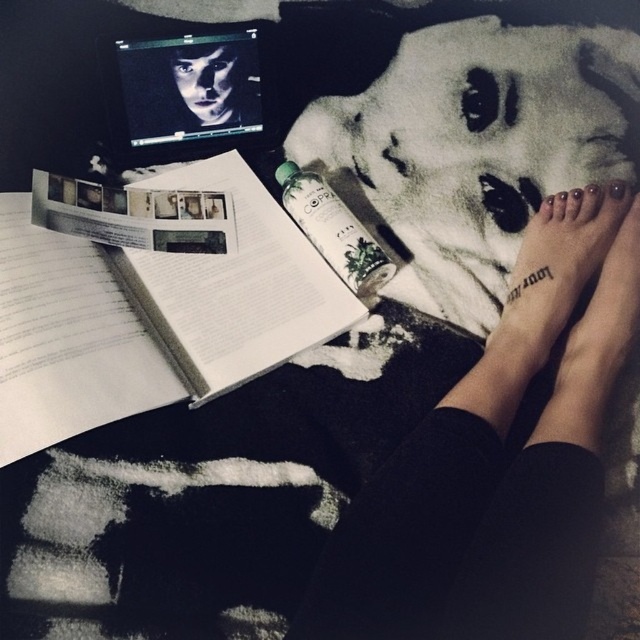
You are looking at the image from above. There are two points marked in the scene. The first point is at coordinates point (461, 550) and the second is at point (497, 136). Which of these points is closer to you?

Point (461, 550) is closer to the viewer than point (497, 136).

You are a person sitting in the scene and want to place a new object at the point represented by point [474,148]. What object is already located there?

The white matte towel at upper center is located at point [474,148].

You are a person sitting at the edge of the frame. You want to reach the point at coordinates point (x=632, y=170) with your hand. Can you comfortably reach it without moving your body?

The point (x=632, y=170) is 29.12 inches away from you, so yes, you can comfortably reach it with your hand without moving your body since the distance is within typical arm reach.